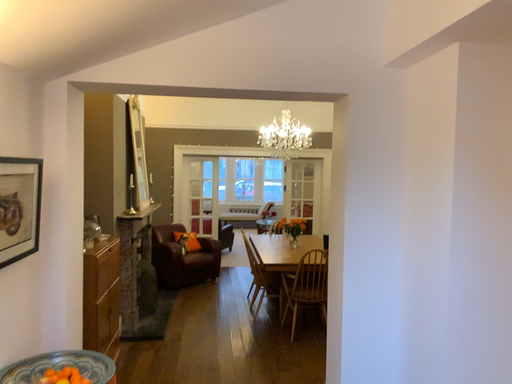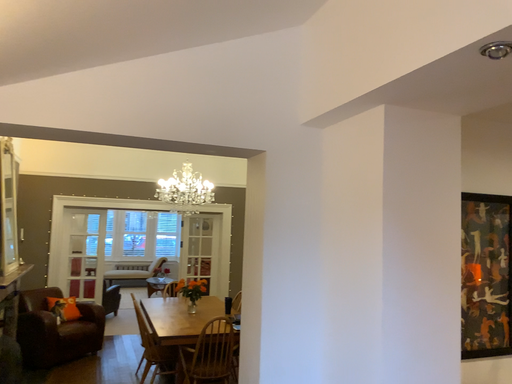
Question: How did the camera likely rotate when shooting the video?

Choices:
 (A) rotated downward
 (B) rotated upward

Answer: (B)